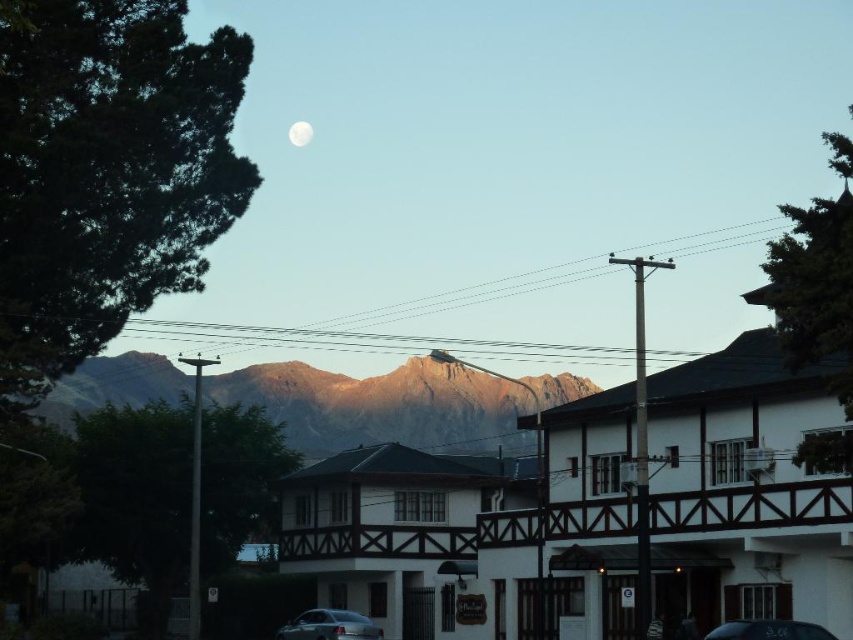
Question: Which point is closer to the camera?

Choices:
 (A) shiny black car at lower center
 (B) satin silver sedan at lower center
 (C) white wooden hotel at center
 (D) white wood house at center

Answer: (C)

Question: Can you confirm if white wood house at center is positioned to the left of satin silver sedan at lower center?

Choices:
 (A) yes
 (B) no

Answer: (B)

Question: Observing the image, what is the correct spatial positioning of rugged brown mountain at center in reference to satin silver sedan at lower center?

Choices:
 (A) below
 (B) above

Answer: (B)

Question: Does satin silver sedan at lower center appear on the left side of white matte moon at upper center?

Choices:
 (A) yes
 (B) no

Answer: (B)

Question: Which point is farther to the camera?

Choices:
 (A) (801, 627)
 (B) (354, 637)
 (C) (378, 580)

Answer: (C)

Question: Which point is farther from the camera taking this photo?

Choices:
 (A) (730, 529)
 (B) (830, 636)
 (C) (335, 424)
 (D) (415, 467)

Answer: (C)